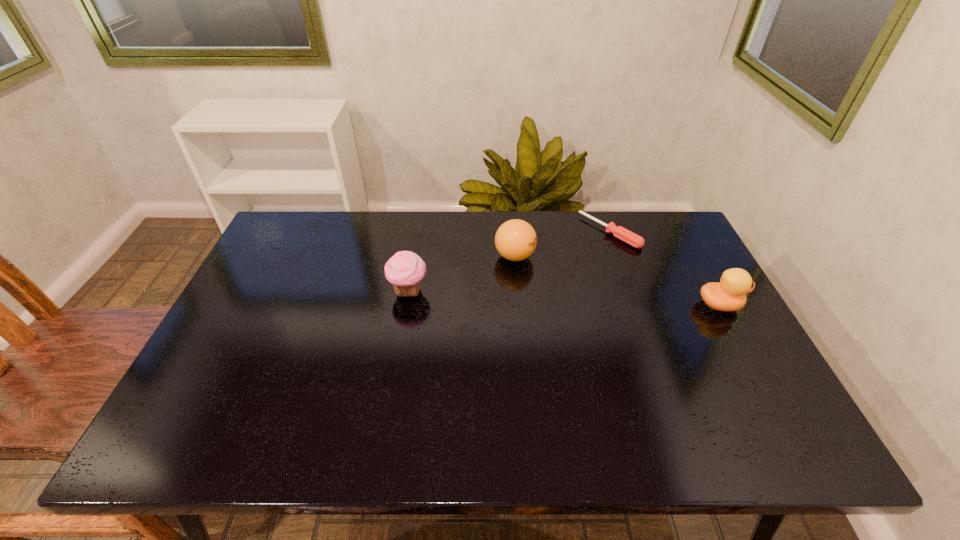
I want to click on free space that is in between the ping-pong ball and the leftmost object, so click(x=462, y=273).

Find the location of a particular element. The width and height of the screenshot is (960, 540). blank region between the screwdriver and the rightmost object is located at coordinates (664, 268).

The image size is (960, 540). I want to click on free space that is in between the second object from right to left and the rightmost object, so click(x=664, y=268).

Image resolution: width=960 pixels, height=540 pixels. I want to click on object that is the nearest to the screwdriver, so click(x=515, y=240).

Choose which object is the second nearest neighbor to the second object from left to right. Please provide its 2D coordinates. Your answer should be formatted as a tuple, i.e. [(x, y)], where the tuple contains the x and y coordinates of a point satisfying the conditions above.

[(405, 270)]

At what (x,y) coordinates should I click in order to perform the action: click on vacant space that satisfies the following two spatial constraints: 1. on the back side of the shortest object; 2. on the left side of the leftmost object. Please return your answer as a coordinate pair (x, y). This screenshot has height=540, width=960. Looking at the image, I should click on (419, 232).

The height and width of the screenshot is (540, 960). I want to click on vacant area in the image that satisfies the following two spatial constraints: 1. on the back side of the second object from left to right; 2. on the left side of the third object from left to right, so click(x=513, y=232).

You are a GUI agent. You are given a task and a screenshot of the screen. Output one action in this format:
    pyautogui.click(x=<x>, y=<y>)
    Task: Click on the free space in the image that satisfies the following two spatial constraints: 1. on the front side of the rightmost object; 2. on the face of the cupcake
    The image size is (960, 540).
    Given the screenshot: What is the action you would take?
    pyautogui.click(x=406, y=305)

Locate an element on the screen. This screenshot has width=960, height=540. free spot that satisfies the following two spatial constraints: 1. on the back side of the leftmost object; 2. on the left side of the third object from right to left is located at coordinates (415, 256).